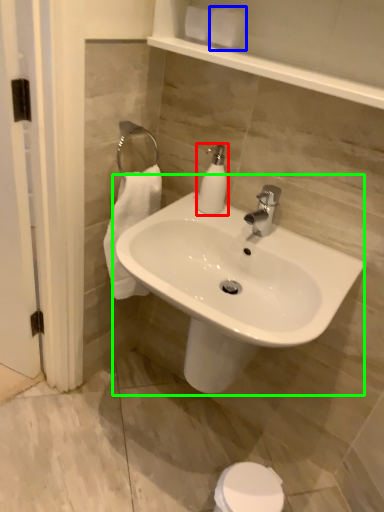
Question: Considering the real-world distances, which object is farthest from soap dispenser (highlighted by a red box)? toilet paper (highlighted by a blue box) or sink (highlighted by a green box)?

Choices:
 (A) toilet paper
 (B) sink

Answer: (A)